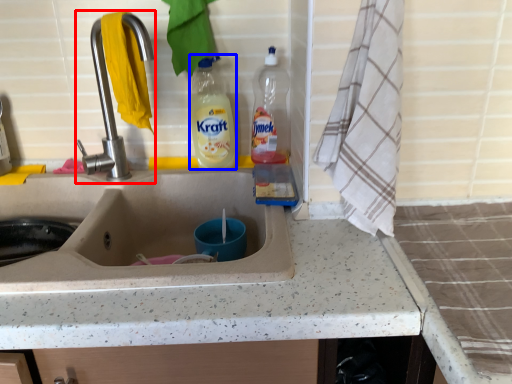
Question: Which point is further to the camera, tap (highlighted by a red box) or bottle (highlighted by a blue box)?

Choices:
 (A) tap
 (B) bottle

Answer: (B)